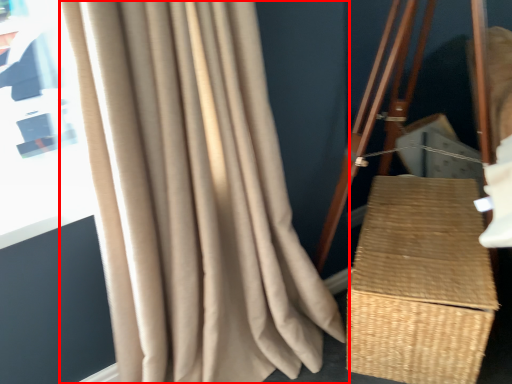
Question: From the image's perspective, what is the correct spatial relationship of curtain (annotated by the red box) in relation to basket?

Choices:
 (A) above
 (B) below

Answer: (A)